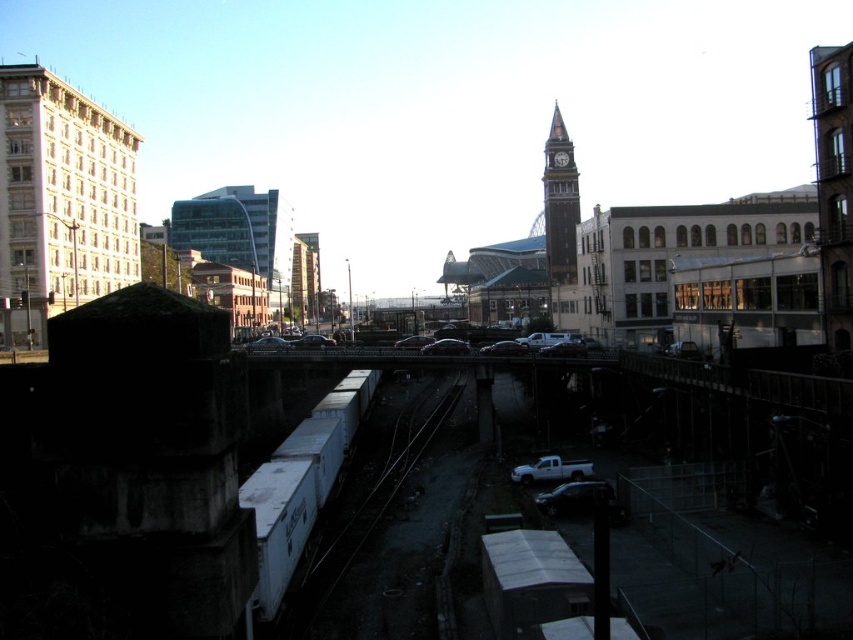
Question: Can you confirm if white textured building at left is positioned above shiny black sedan at center?

Choices:
 (A) no
 (B) yes

Answer: (B)

Question: Which object is closer to the camera taking this photo?

Choices:
 (A) white matte train track at center
 (B) white matte truck at lower center
 (C) shiny black sedan at center

Answer: (A)

Question: Which of the following is the farthest from the observer?

Choices:
 (A) (299, 346)
 (B) (16, 328)
 (C) (550, 122)

Answer: (C)

Question: Which point is farther from the camera taking this photo?

Choices:
 (A) (306, 346)
 (B) (115, 275)
 (C) (471, 452)

Answer: (B)

Question: Is white matte train track at center wider than white textured building at left?

Choices:
 (A) yes
 (B) no

Answer: (A)

Question: Does white matte train track at center appear over brown stone clock tower at center?

Choices:
 (A) no
 (B) yes

Answer: (A)